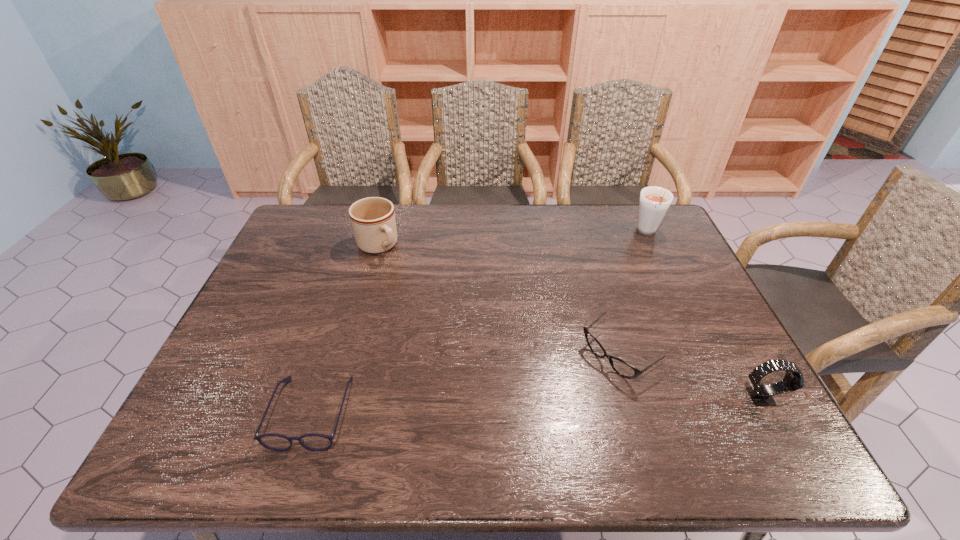
At what (x,y) coordinates should I click in order to perform the action: click on the left spectacles. Please return your answer as a coordinate pair (x, y). The image size is (960, 540). Looking at the image, I should click on (312, 441).

I want to click on watch, so tap(761, 395).

The width and height of the screenshot is (960, 540). Identify the location of mug. (373, 222).

Identify the location of root beer. click(x=654, y=202).

Locate an element on the screen. This screenshot has height=540, width=960. the third object from left to right is located at coordinates (624, 369).

The width and height of the screenshot is (960, 540). In order to click on vacant region located 0.200m on the side of the mug with the handle in this screenshot , I will do `click(420, 295)`.

Where is `blank space located 0.060m on the side of the mug with the handle`? blank space located 0.060m on the side of the mug with the handle is located at coordinates (396, 269).

The image size is (960, 540). What are the coordinates of `free region located 0.060m on the side of the mug with the handle` in the screenshot? It's located at (396, 269).

Find the location of a particular element. free space located on the drink side of the root beer is located at coordinates (614, 326).

What are the coordinates of `blank space located 0.340m on the drink side of the root beer` in the screenshot? It's located at (620, 311).